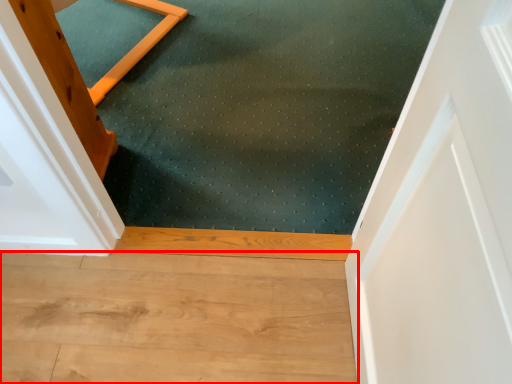
Question: Where is hardwood (annotated by the red box) located in relation to mat in the image?

Choices:
 (A) right
 (B) left

Answer: (B)